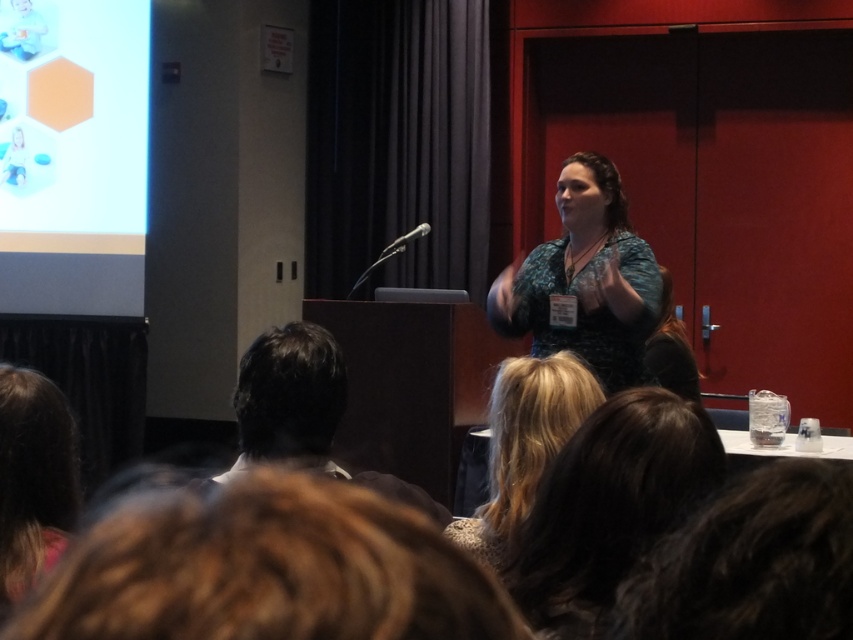
Describe the element at coordinates (524, 444) in the screenshot. I see `blonde hair at center` at that location.

Does point (514, 524) lie in front of point (283, 352)?

Yes, point (514, 524) is in front of point (283, 352).

Find the location of a particular element. The image size is (853, 640). blonde hair at center is located at coordinates (524, 444).

Between brown hair at lower center and matte green dress at center, which one has less height?

Standing shorter between the two is brown hair at lower center.

Who is positioned more to the left, brown hair at lower center or matte green dress at center?

From the viewer's perspective, brown hair at lower center appears more on the left side.

Between point (321, 602) and point (498, 278), which one is positioned in front?

Positioned in front is point (321, 602).

You are a GUI agent. You are given a task and a screenshot of the screen. Output one action in this format:
    pyautogui.click(x=<x>, y=<y>)
    Task: Click on the brown hair at lower center
    
    Given the screenshot: What is the action you would take?
    pyautogui.click(x=265, y=570)

Is matte green dress at center shorter than dark brown hair at lower left?

No, matte green dress at center is not shorter than dark brown hair at lower left.

Who is more forward, (511,304) or (251,442)?

Point (251,442)

Is point (608, 224) more distant than point (271, 378)?

Yes, it is.

At what (x,y) coordinates should I click in order to perform the action: click on matte green dress at center. Please return your answer as a coordinate pair (x, y). The height and width of the screenshot is (640, 853). Looking at the image, I should click on (585, 278).